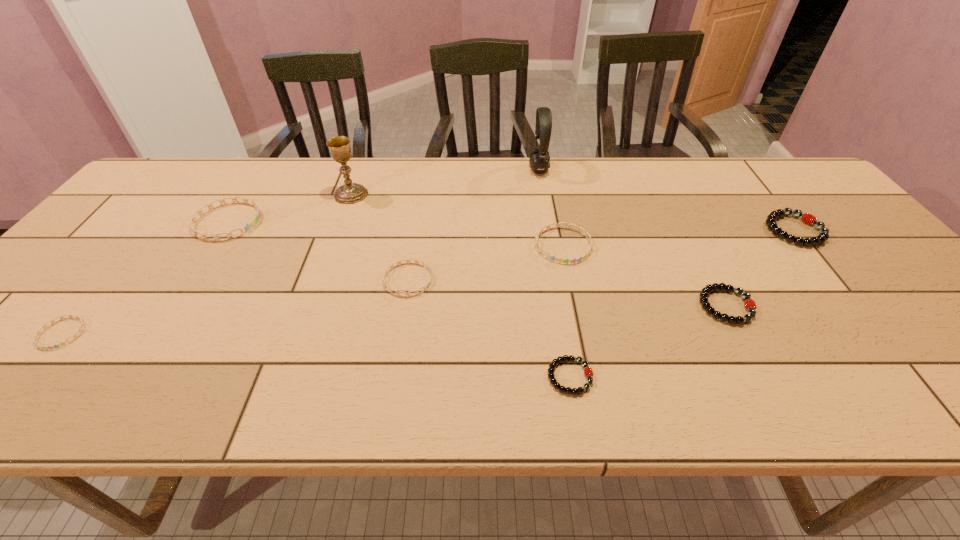
The image size is (960, 540). I want to click on blank space located 0.110m on the surface of the second bracelet from left to right showing star-shaped elements, so click(x=300, y=221).

Image resolution: width=960 pixels, height=540 pixels. I want to click on vacant space situated 0.270m on the left of the biggest black bracelet, so click(x=666, y=230).

You are a GUI agent. You are given a task and a screenshot of the screen. Output one action in this format:
    pyautogui.click(x=<x>, y=<y>)
    Task: Click on the free spot located 0.170m on the surface of the rightmost blue bracelet showing star-shaped elements
    
    Given the screenshot: What is the action you would take?
    pyautogui.click(x=578, y=318)

Where is `vacant space located on the front of the second nearest black bracelet`? The height and width of the screenshot is (540, 960). vacant space located on the front of the second nearest black bracelet is located at coordinates (776, 402).

Identify the location of free space located 0.180m on the surface of the third bracelet from left to right showing star-shaped elements. Image resolution: width=960 pixels, height=540 pixels. (508, 280).

Find the location of `vacant space situated on the right of the smallest black bracelet`. vacant space situated on the right of the smallest black bracelet is located at coordinates (714, 377).

The height and width of the screenshot is (540, 960). I want to click on vacant space located on the surface of the leftmost bracelet showing star-shaped elements, so click(x=12, y=393).

The width and height of the screenshot is (960, 540). Find the location of `headset present at the far edge`. headset present at the far edge is located at coordinates (539, 158).

The image size is (960, 540). Identify the location of chalice present at the far edge. (349, 193).

The image size is (960, 540). What are the coordinates of `object that is at the near edge` in the screenshot? It's located at (588, 372).